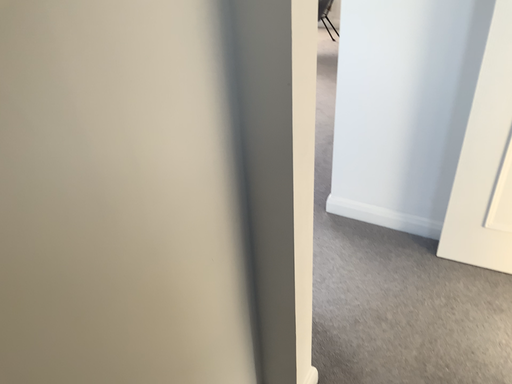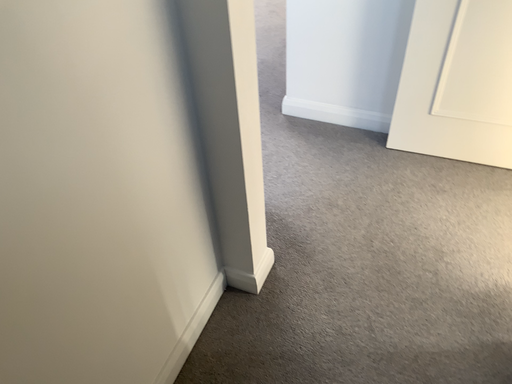
Question: How did the camera likely rotate when shooting the video?

Choices:
 (A) rotated upward
 (B) rotated downward

Answer: (B)